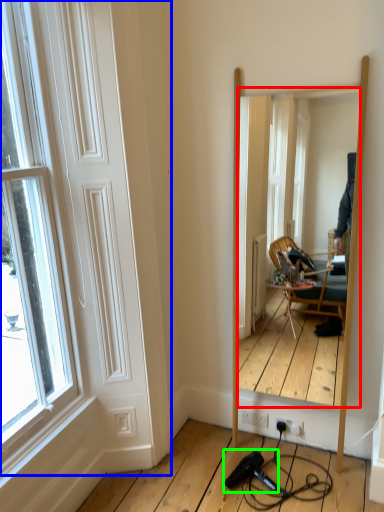
Question: Estimate the real-world distances between objects in this image. Which object is farther from mirror (highlighted by a red box), door (highlighted by a blue box) or hair drier (highlighted by a green box)?

Choices:
 (A) door
 (B) hair drier

Answer: (B)